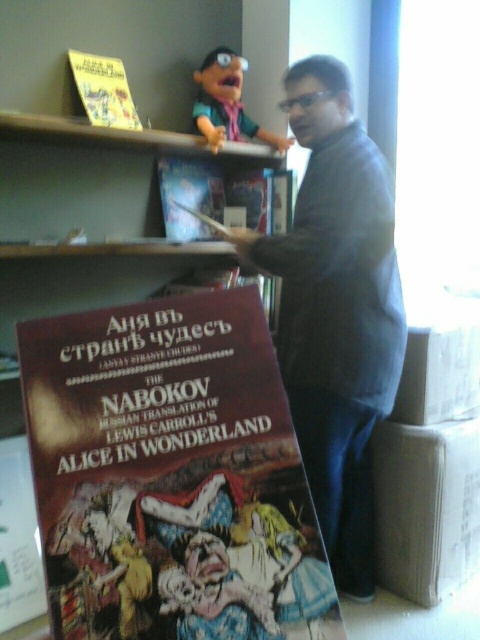
Between dark gray sweater at center and yellow paper book at upper left, which one appears on the right side from the viewer's perspective?

From the viewer's perspective, dark gray sweater at center appears more on the right side.

Between dark gray sweater at center and yellow paper book at upper left, which one is positioned higher?

yellow paper book at upper left is above.

Is point (337, 387) positioned before point (91, 70)?

Yes.

Where is `dark gray sweater at center`? dark gray sweater at center is located at coordinates (336, 308).

From the picture: Does dark gray sweater at center have a greater height compared to pink fabric doll at upper center?

Correct, dark gray sweater at center is much taller as pink fabric doll at upper center.

Which is above, dark gray sweater at center or pink fabric doll at upper center?

pink fabric doll at upper center is higher up.

Who is more distant from viewer, (302, 88) or (241, 140)?

The point (241, 140) is behind.

The height and width of the screenshot is (640, 480). Identify the location of dark gray sweater at center. (336, 308).

Is point (186, 468) farther from camera compared to point (315, 444)?

No, (186, 468) is in front of (315, 444).

Is maroon paperback book at center thinner than dark gray sweater at center?

Incorrect, maroon paperback book at center's width is not less than dark gray sweater at center's.

This screenshot has height=640, width=480. I want to click on maroon paperback book at center, so click(x=170, y=476).